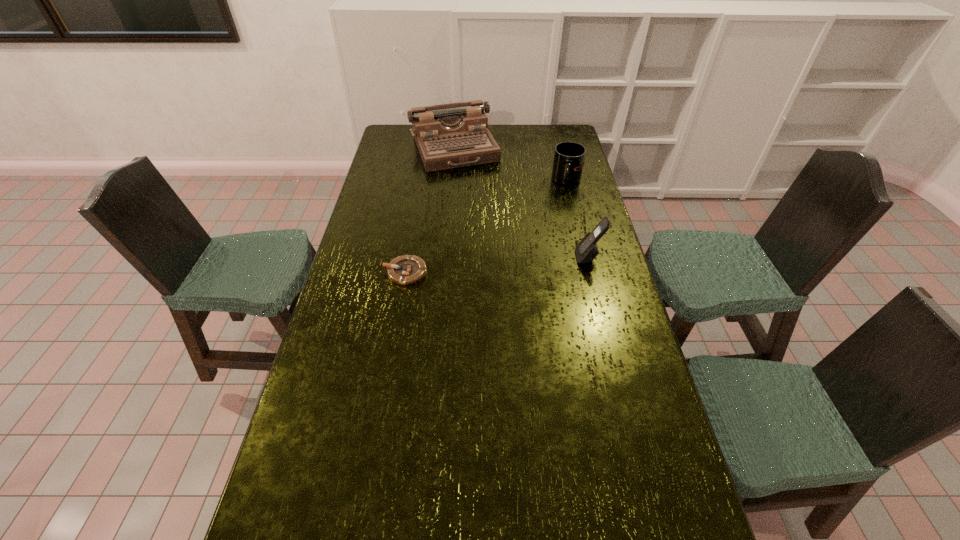
Locate an element on the screen. the shortest object is located at coordinates (404, 270).

I want to click on the second tallest object, so click(x=586, y=250).

Identify the location of mug. (568, 162).

Image resolution: width=960 pixels, height=540 pixels. What are the coordinates of `typewriter` in the screenshot? It's located at (452, 135).

Identify the location of vacant space situated on the front of the shortest object. (390, 366).

Locate an element on the screen. This screenshot has height=540, width=960. vacant space located on the front-facing side of the second tallest object is located at coordinates (505, 257).

The image size is (960, 540). In order to click on free location located on the front-facing side of the second tallest object in this screenshot , I will do `click(550, 257)`.

Find the location of `vacant space located 0.390m on the front-facing side of the second tallest object`. vacant space located 0.390m on the front-facing side of the second tallest object is located at coordinates (466, 257).

Identify the location of free space located 0.160m with the handle on the side of the mug. The image size is (960, 540). (550, 212).

At what (x,y) coordinates should I click in order to perform the action: click on free region located 0.370m with the handle on the side of the mug. Please return your answer as a coordinate pair (x, y). Looking at the image, I should click on (531, 242).